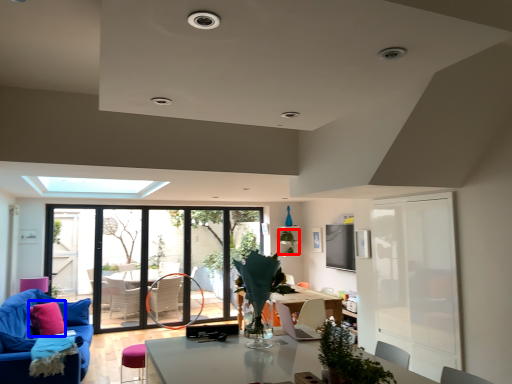
Question: Which object is closer to the camera taking this photo, plant (highlighted by a red box) or pillow (highlighted by a blue box)?

Choices:
 (A) plant
 (B) pillow

Answer: (B)